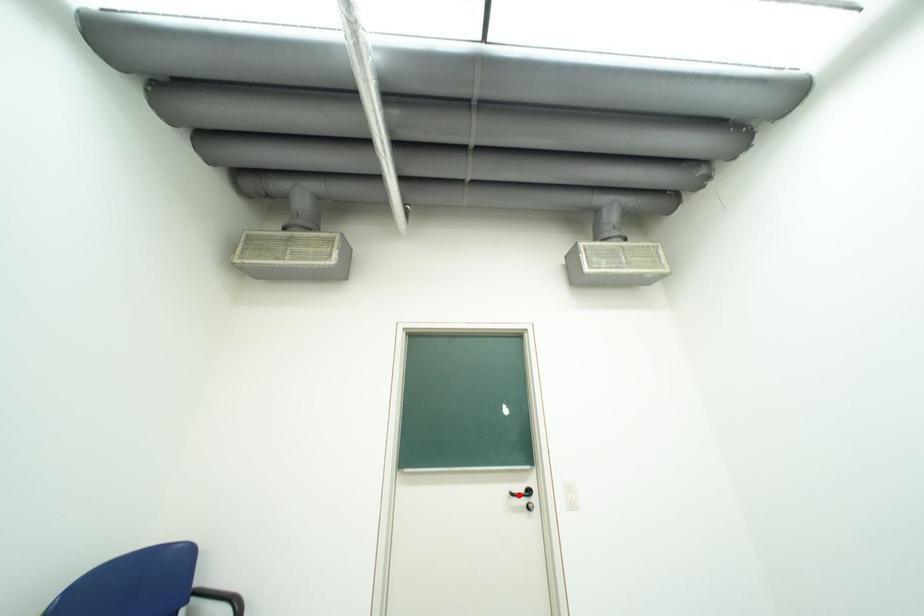
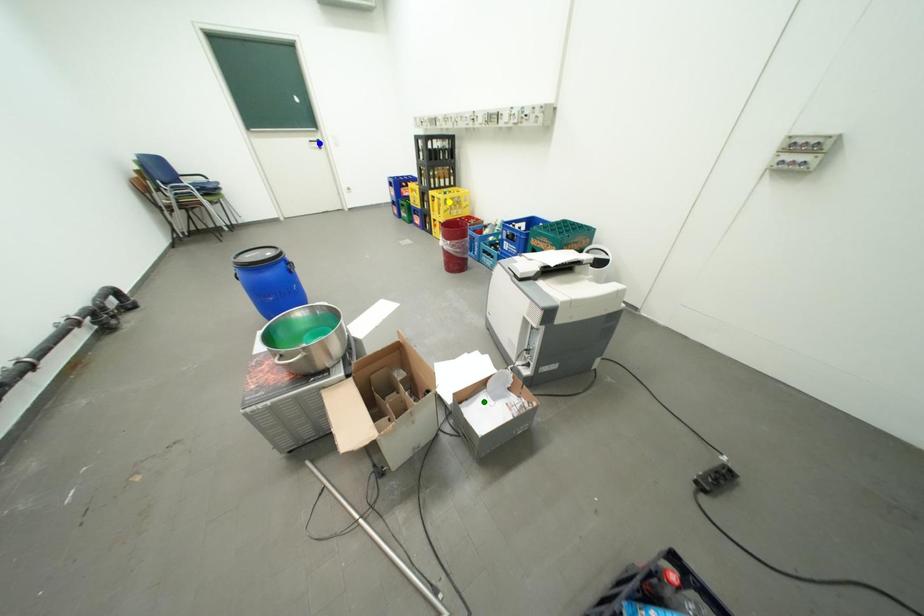
Question: I am providing you with two images of the same scene from different viewpoints. A red point is marked on the first image. You are given multiple points on the second image. In image 2, which mark is for the same physical point as the one in image 1?

Choices:
 (A) yellow point
 (B) green point
 (C) blue point

Answer: (C)